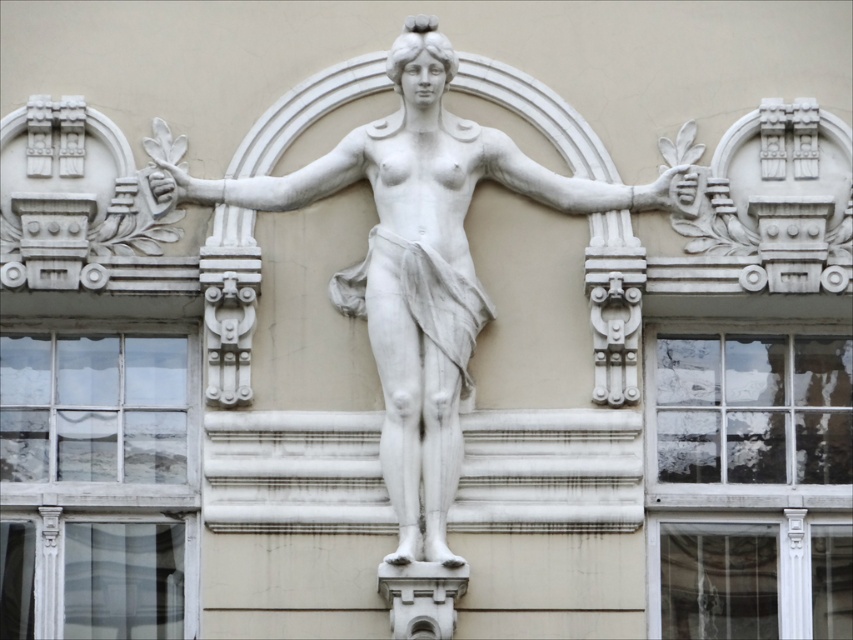
Question: Is white marble arm at center to the left of white marble hand at upper left from the viewer's perspective?

Choices:
 (A) no
 (B) yes

Answer: (A)

Question: Which point is closer to the camera?

Choices:
 (A) (698, 150)
 (B) (688, 172)

Answer: (B)

Question: Is white stone arm at center thinner than white stone hand at upper right?

Choices:
 (A) yes
 (B) no

Answer: (B)

Question: Is white marble arm at center thinner than white stone arm at center?

Choices:
 (A) no
 (B) yes

Answer: (B)

Question: Which point is closer to the camera taking this photo?

Choices:
 (A) (180, 179)
 (B) (578, 180)

Answer: (A)

Question: Which point is closer to the camera?

Choices:
 (A) (488, 172)
 (B) (148, 179)
 (C) (368, 289)

Answer: (C)